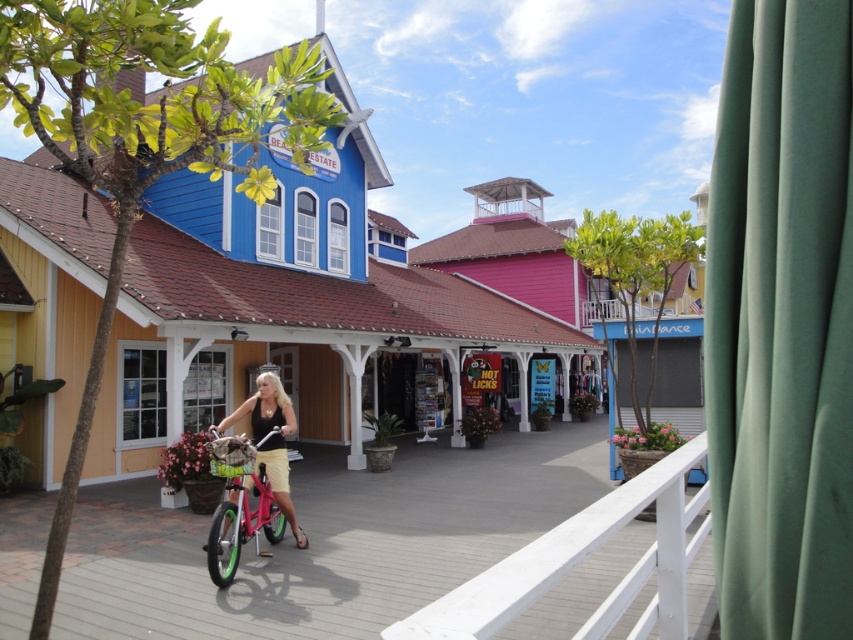
You are a delivery person standing at the edge of the walkway and need to place a package between the white wooden rail at center and the matte black tank top at center. The package requires 10 feet of space. Is there enough space between them?

The white wooden rail at center and matte black tank top at center are 15.30 feet apart, so yes, there is enough space between them to place the package as it requires only 10 feet.

You are a painter standing on the wooden walkway and want to paint the white wooden rail at center and the matte black tank top at center. Which object requires more paint to cover its width?

The matte black tank top at center requires more paint to cover its width because it is wider than the white wooden rail at center.